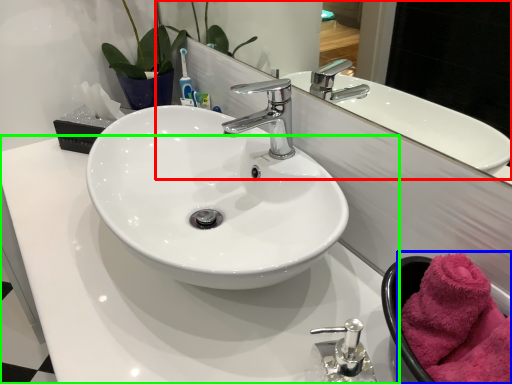
Question: Which is nearer to the mirror (highlighted by a red box)? bath towel (highlighted by a blue box) or counter top (highlighted by a green box).

Choices:
 (A) bath towel
 (B) counter top

Answer: (B)